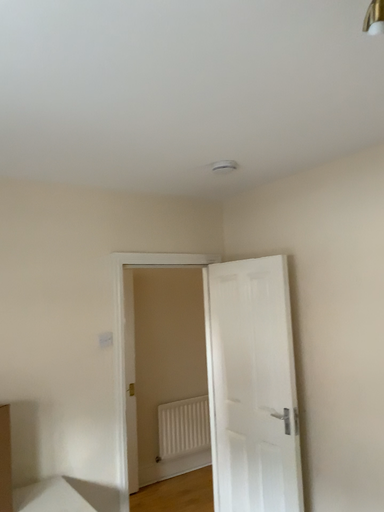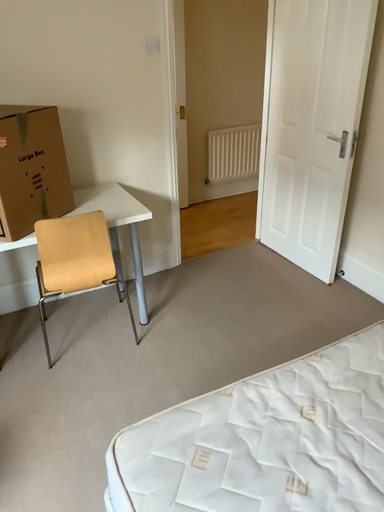
Question: Which way did the camera rotate in the video?

Choices:
 (A) rotated right
 (B) rotated left

Answer: (B)